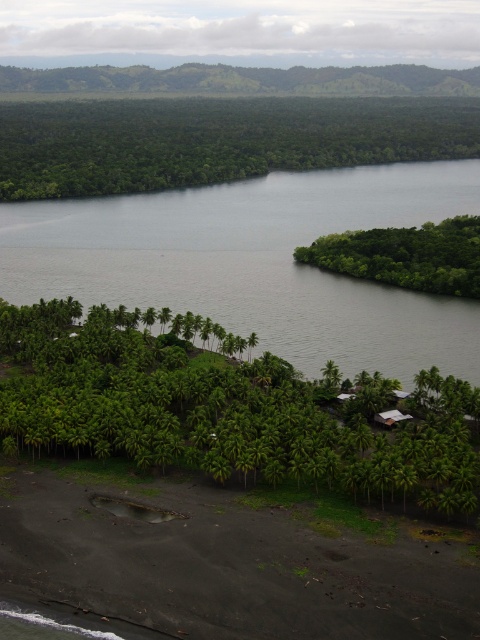
Question: Based on their relative distances, which object is nearer to the green leafy forest at upper center?

Choices:
 (A) green leafy island at right
 (B) green leafy palm trees at lower center

Answer: (A)

Question: Does green leafy palm trees at lower center appear on the right side of green leafy forest at upper center?

Choices:
 (A) yes
 (B) no

Answer: (B)

Question: Based on their relative distances, which object is farther from the green leafy palm trees at lower center?

Choices:
 (A) green leafy forest at upper center
 (B) green leafy island at right

Answer: (A)

Question: Is green leafy palm trees at lower center smaller than green leafy forest at upper center?

Choices:
 (A) no
 (B) yes

Answer: (B)

Question: Which point is farther from the camera taking this photo?

Choices:
 (A) (474, 118)
 (B) (427, 397)
 (C) (427, 280)

Answer: (A)

Question: Can you confirm if green leafy palm trees at lower center is positioned below green leafy forest at upper center?

Choices:
 (A) no
 (B) yes

Answer: (B)